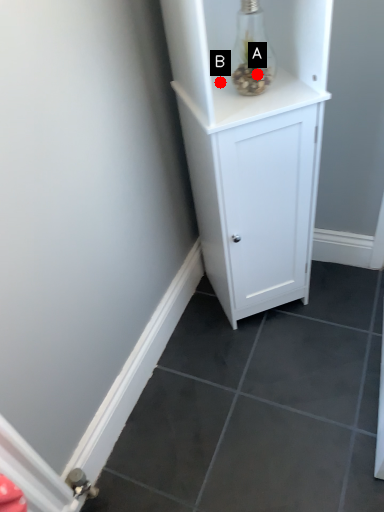
Question: Two points are circled on the image, labeled by A and B beside each circle. Which point appears closest to the camera in this image?

Choices:
 (A) A is closer
 (B) B is closer

Answer: (A)